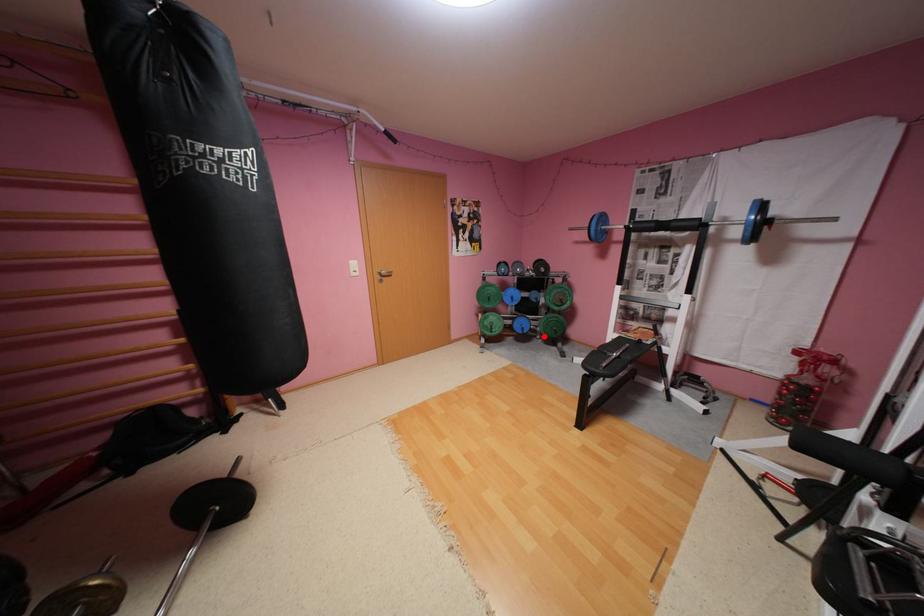
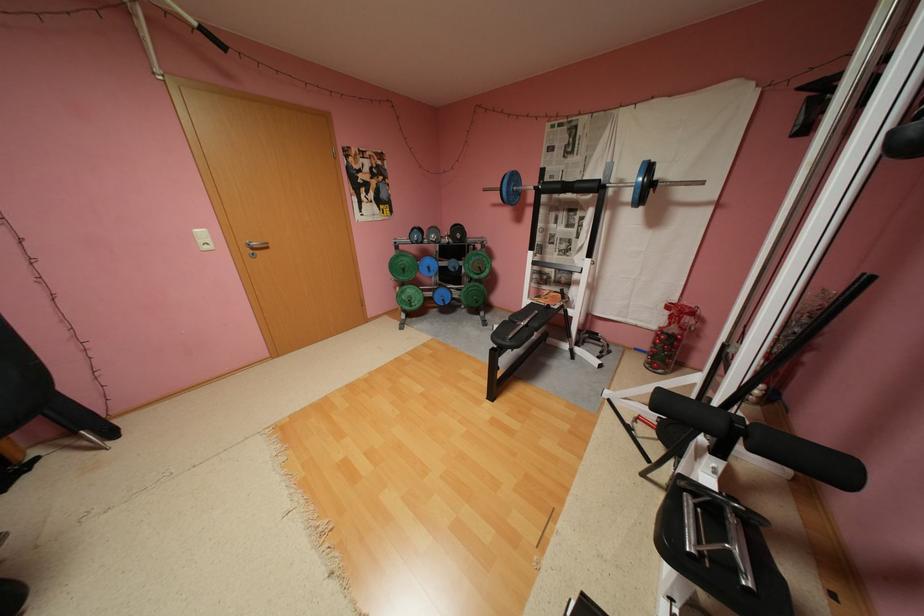
Question: I am providing you with two images of the same scene from different viewpoints. Image1 has a red point marked. In image2, the corresponding 3D location appears at what relative position? Reply with the corresponding letter.

Choices:
 (A) Closer
 (B) Farther

Answer: (A)